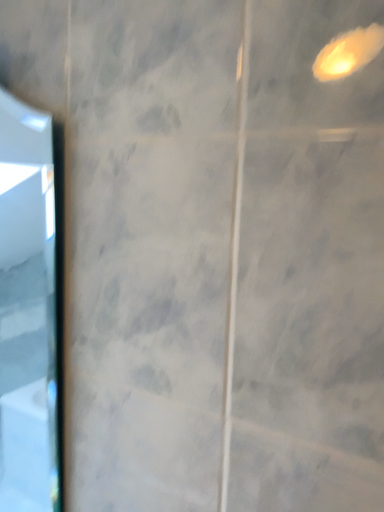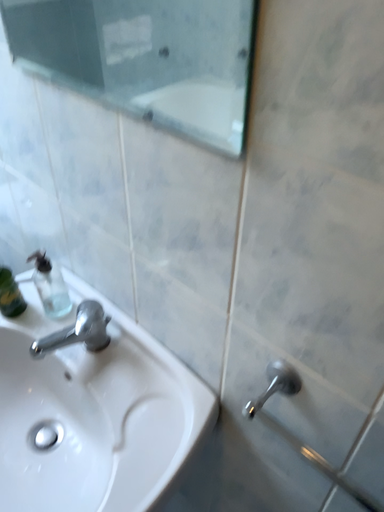
Question: How did the camera likely rotate when shooting the video?

Choices:
 (A) rotated left
 (B) rotated right

Answer: (A)